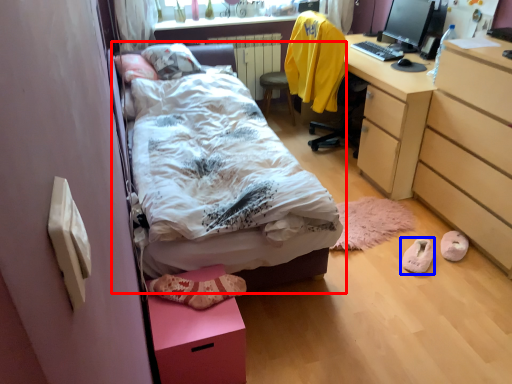
Question: Which object appears closest to the camera in this image, bed (highlighted by a red box) or footwear (highlighted by a blue box)?

Choices:
 (A) bed
 (B) footwear

Answer: (A)